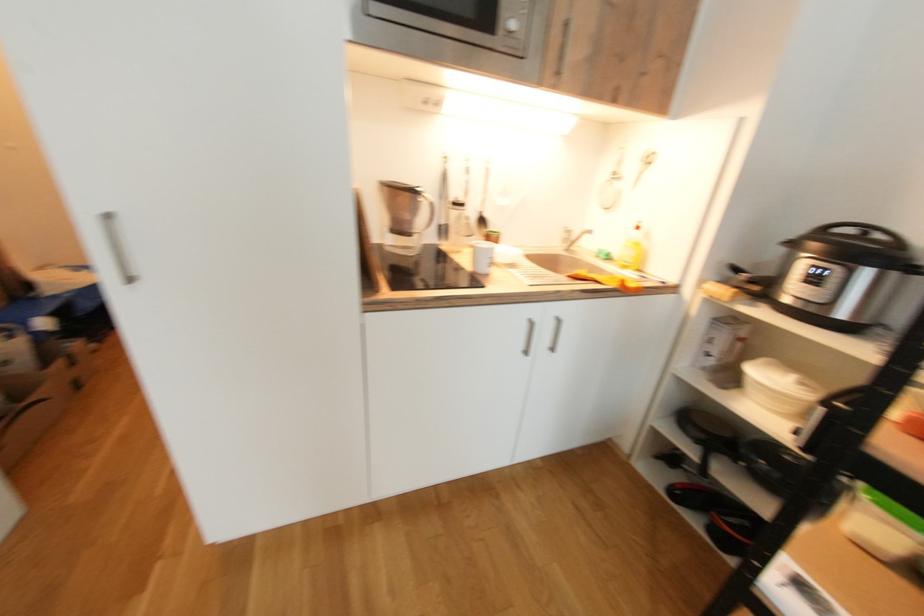
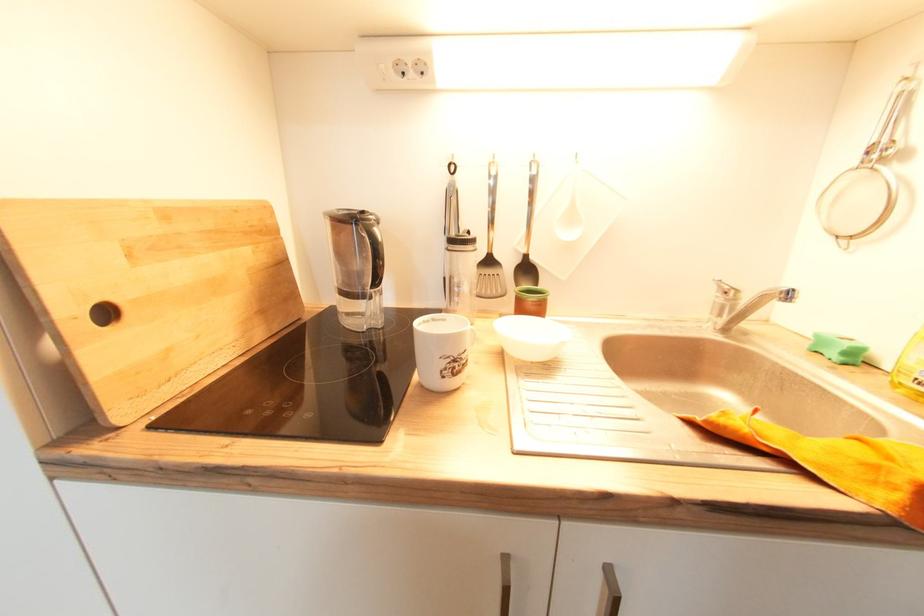
In a continuous first-person perspective shot, in which direction is the camera moving?

The cameraman moved toward right, forward.